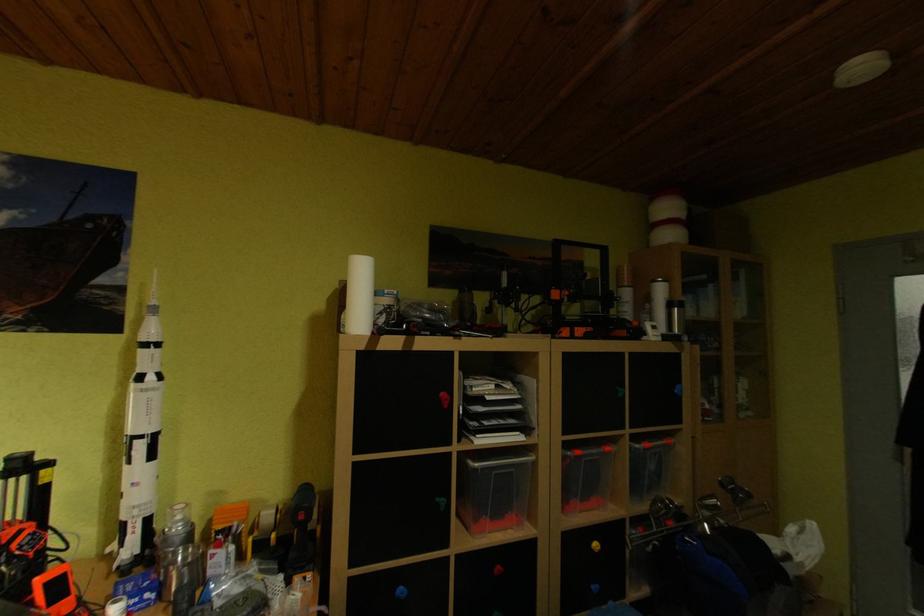
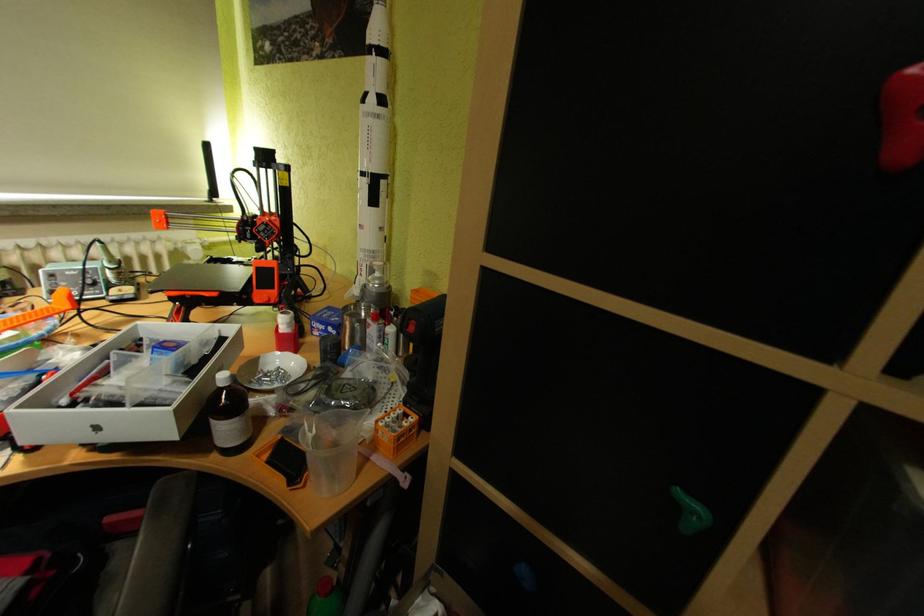
The first image is from the beginning of the video and the second image is from the end. How did the camera likely rotate when shooting the video?

The rotation direction of the camera is left-down.